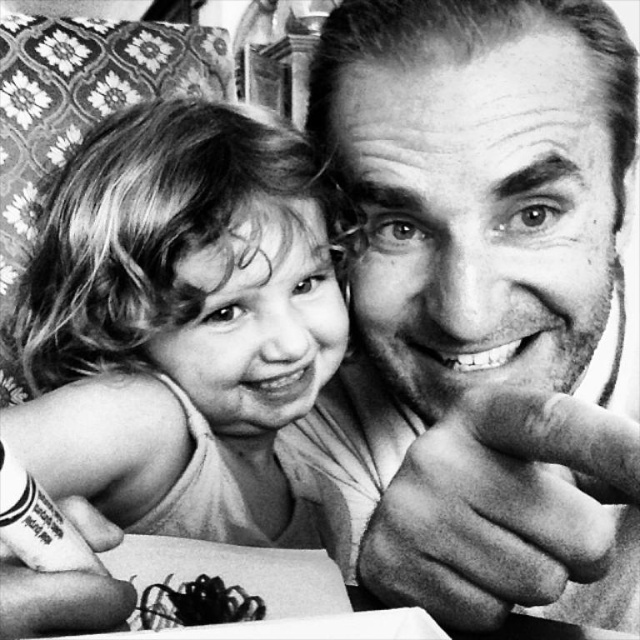
Between point (595, 490) and point (22, 570), which one is positioned behind?

Point (595, 490)

Between point (365, 392) and point (81, 624), which one is positioned in front?

Point (81, 624) is more forward.

What do you see at coordinates (480, 305) in the screenshot? This screenshot has height=640, width=640. I see `smooth skin face at upper right` at bounding box center [480, 305].

Where is `smooth skin face at upper right`? smooth skin face at upper right is located at coordinates [480, 305].

Does point (340, 316) come behind point (13, 577)?

Yes, it is.

What do you see at coordinates (182, 328) in the screenshot? This screenshot has height=640, width=640. I see `smooth blonde hair at left` at bounding box center [182, 328].

The width and height of the screenshot is (640, 640). Find the location of `smooth blonde hair at left`. smooth blonde hair at left is located at coordinates (182, 328).

Which is more to the right, flesh-toned skin at center or black tattooed hand at lower left?

From the viewer's perspective, flesh-toned skin at center appears more on the right side.

Is flesh-toned skin at center behind black tattooed hand at lower left?

No, flesh-toned skin at center is in front of black tattooed hand at lower left.

You are a GUI agent. You are given a task and a screenshot of the screen. Output one action in this format:
    pyautogui.click(x=<x>, y=<y>)
    Task: Click on the flesh-toned skin at center
    This screenshot has height=640, width=640.
    Given the screenshot: What is the action you would take?
    pyautogui.click(x=499, y=506)

In order to click on flesh-toned skin at center in this screenshot , I will do `click(499, 506)`.